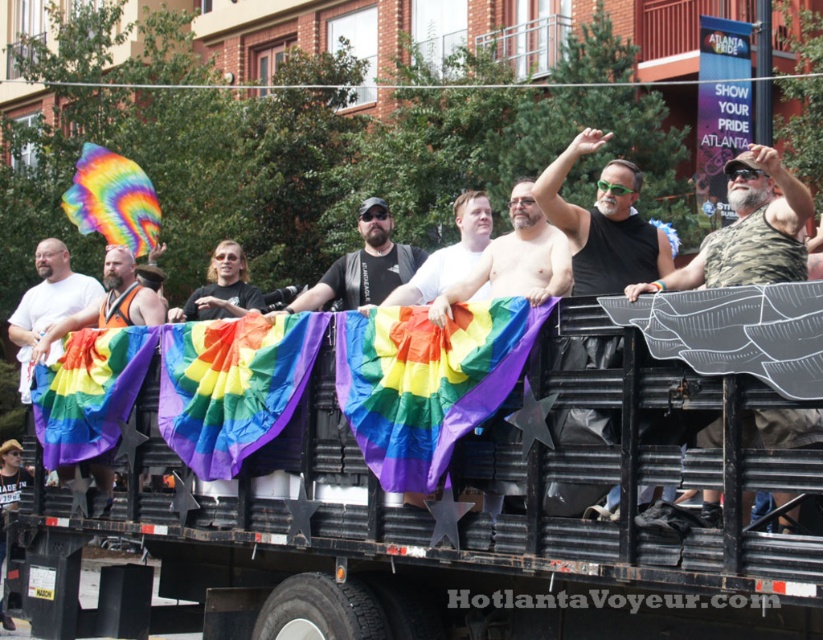
Question: Which object is positioned farthest from the shiny black tank top at center?

Choices:
 (A) matte black tank top at center
 (B) camouflage tank top at center
 (C) black corrugated metal truck at center
 (D) matte white shirt at center

Answer: (A)

Question: Is black corrugated metal truck at center to the right of camouflage tank top at center from the viewer's perspective?

Choices:
 (A) yes
 (B) no

Answer: (B)

Question: Does black corrugated metal truck at center appear over camouflage tank top at center?

Choices:
 (A) no
 (B) yes

Answer: (A)

Question: Observing the image, what is the correct spatial positioning of camouflage tank top at center in reference to shiny black tank top at center?

Choices:
 (A) left
 (B) right

Answer: (B)

Question: Among these points, which one is nearest to the camera?

Choices:
 (A) (602, 216)
 (B) (566, 284)
 (C) (470, 266)

Answer: (B)

Question: Among these points, which one is farthest from the camera?

Choices:
 (A) (586, 465)
 (B) (463, 285)
 (C) (614, 211)

Answer: (C)